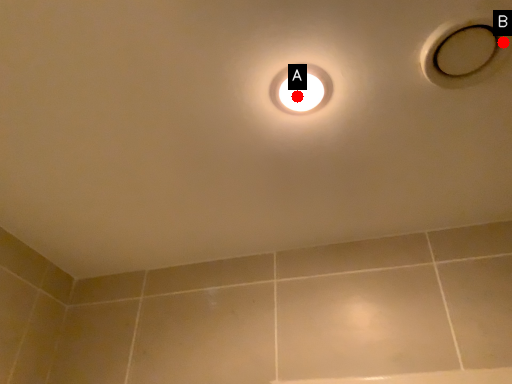
Question: Two points are circled on the image, labeled by A and B beside each circle. Which point is further to the camera?

Choices:
 (A) A is further
 (B) B is further

Answer: (A)